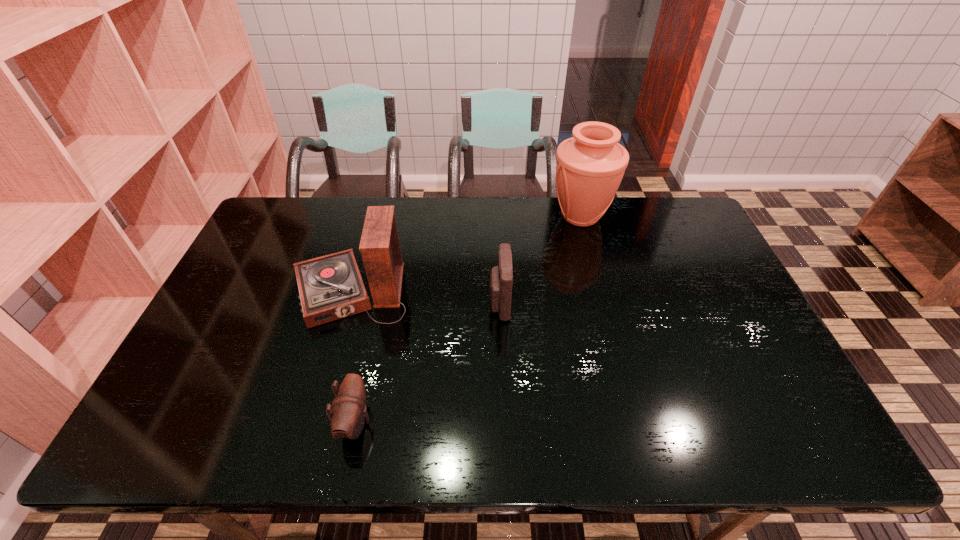
Image resolution: width=960 pixels, height=540 pixels. Identify the location of the tallest object. (590, 166).

You are a GUI agent. You are given a task and a screenshot of the screen. Output one action in this format:
    pyautogui.click(x=<x>, y=<y>)
    Task: Click on the vase
    
    Given the screenshot: What is the action you would take?
    pyautogui.click(x=590, y=166)

At what (x,y) coordinates should I click in order to perform the action: click on the second tallest object. Please return your answer as a coordinate pair (x, y). Image resolution: width=960 pixels, height=540 pixels. Looking at the image, I should click on (330, 287).

At what (x,y) coordinates should I click in order to perform the action: click on the third tallest object. Please return your answer as a coordinate pair (x, y). This screenshot has width=960, height=540. Looking at the image, I should click on (501, 277).

The image size is (960, 540). Find the location of `the second object from right to left`. the second object from right to left is located at coordinates (501, 277).

Locate an element on the screen. the left pouch is located at coordinates (349, 413).

Find the location of a particular element. the nearest object is located at coordinates (349, 413).

Locate an element on the screen. This screenshot has height=540, width=960. vacant space located on the left of the vase is located at coordinates (515, 217).

The image size is (960, 540). I want to click on vacant area situated 0.170m on the left of the phonograph record, so click(233, 292).

You are a GUI agent. You are given a task and a screenshot of the screen. Output one action in this format:
    pyautogui.click(x=<x>, y=<y>)
    Task: Click on the free space located with an open flap on the third object from left to right
    The image size is (960, 540).
    Given the screenshot: What is the action you would take?
    pyautogui.click(x=420, y=303)